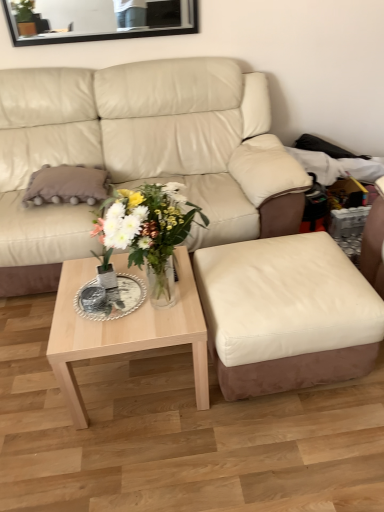
Locate an element on the screen. vacant space underneath light wood/texture coffee table at center (from a real-world perspective) is located at coordinates (143, 376).